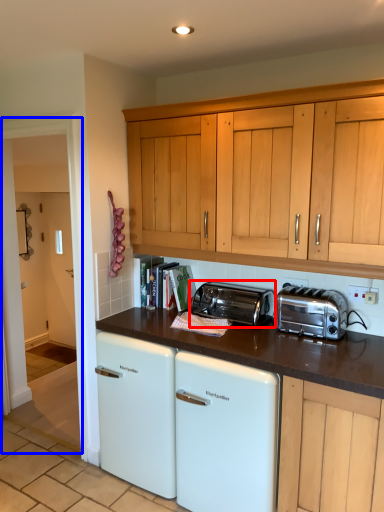
Question: Among these objects, which one is nearest to the camera, toaster (highlighted by a red box) or glass door (highlighted by a blue box)?

Choices:
 (A) toaster
 (B) glass door

Answer: (A)